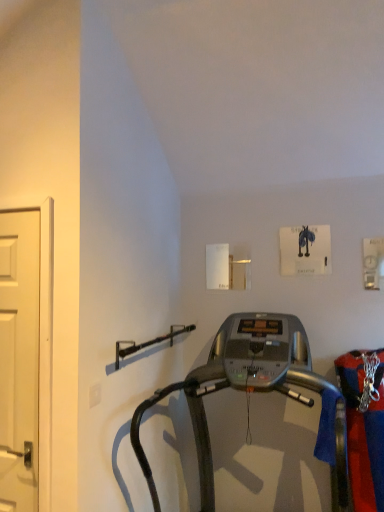
Describe the element at coordinates (19, 359) in the screenshot. I see `white matte door at left` at that location.

The width and height of the screenshot is (384, 512). I want to click on white matte door at left, so pos(19,359).

The width and height of the screenshot is (384, 512). Describe the element at coordinates (249, 390) in the screenshot. I see `silver metallic treadmill at center` at that location.

The height and width of the screenshot is (512, 384). I want to click on silver metallic treadmill at center, so click(x=249, y=390).

Image resolution: width=384 pixels, height=512 pixels. I want to click on white matte door at left, so click(x=19, y=359).

In the image, is silver metallic treadmill at center on the left side or the right side of white matte door at left?

silver metallic treadmill at center is to the right of white matte door at left.

Is silver metallic treadmill at center further to camera compared to white matte door at left?

No, silver metallic treadmill at center is closer to the camera.

Is point (223, 343) closer to viewer compared to point (31, 366)?

No.

From the image's perspective, does silver metallic treadmill at center appear higher than white matte door at left?

Incorrect, from the image's perspective, silver metallic treadmill at center is lower than white matte door at left.

From a real-world perspective, is silver metallic treadmill at center above or below white matte door at left?

silver metallic treadmill at center is below white matte door at left.

Is silver metallic treadmill at center thinner than white matte door at left?

No, silver metallic treadmill at center is not thinner than white matte door at left.

Considering the relative sizes of silver metallic treadmill at center and white matte door at left in the image provided, is silver metallic treadmill at center taller than white matte door at left?

Yes.

Which of these two, silver metallic treadmill at center or white matte door at left, is smaller?

white matte door at left is smaller.

Is white matte door at left a part of silver metallic treadmill at center?

No, white matte door at left is not a part of silver metallic treadmill at center.

Are silver metallic treadmill at center and white matte door at left making contact?

No, silver metallic treadmill at center is not in contact with white matte door at left.

Is silver metallic treadmill at center aimed at white matte door at left?

No.

How different are the orientations of silver metallic treadmill at center and white matte door at left in degrees?

They differ by 0.476 degrees in their facing directions.

Where is `treadmill that appears in front of the white matte door at left`? The width and height of the screenshot is (384, 512). treadmill that appears in front of the white matte door at left is located at coordinates [x=249, y=390].

Is white matte door at left at the left side of silver metallic treadmill at center?

Indeed, white matte door at left is positioned on the left side of silver metallic treadmill at center.

Based on the photo, is the position of white matte door at left more distant than that of silver metallic treadmill at center?

Yes, white matte door at left is further from the viewer.

Considering the positions of points (27, 493) and (139, 455), is point (27, 493) farther from camera compared to point (139, 455)?

No, (27, 493) is closer to viewer.

From the image's perspective, between white matte door at left and silver metallic treadmill at center, who is located below?

silver metallic treadmill at center, from the image's perspective.

From a real-world perspective, which object rests below the other?

From a 3D spatial view, silver metallic treadmill at center is below.

Which of these two, white matte door at left or silver metallic treadmill at center, is wider?

With larger width is silver metallic treadmill at center.

Between white matte door at left and silver metallic treadmill at center, which one has more height?

With more height is silver metallic treadmill at center.

Who is smaller, white matte door at left or silver metallic treadmill at center?

Smaller between the two is white matte door at left.

Can we say white matte door at left lies outside silver metallic treadmill at center?

That's correct, white matte door at left is outside of silver metallic treadmill at center.

Is the surface of white matte door at left in direct contact with silver metallic treadmill at center?

No, white matte door at left is not with silver metallic treadmill at center.

Is white matte door at left turned away from silver metallic treadmill at center?

No, white matte door at left's orientation is not away from silver metallic treadmill at center.

How many degrees apart are the facing directions of white matte door at left and silver metallic treadmill at center?

The facing directions of white matte door at left and silver metallic treadmill at center are 0.476 degrees apart.

Where is `door that appears above the silver metallic treadmill at center (from the image's perspective)`? door that appears above the silver metallic treadmill at center (from the image's perspective) is located at coordinates (19, 359).

Image resolution: width=384 pixels, height=512 pixels. Identify the location of treadmill that is in front of the white matte door at left. (249, 390).

Find the location of a particular element. The image size is (384, 512). door that is above the silver metallic treadmill at center (from a real-world perspective) is located at coordinates (19, 359).